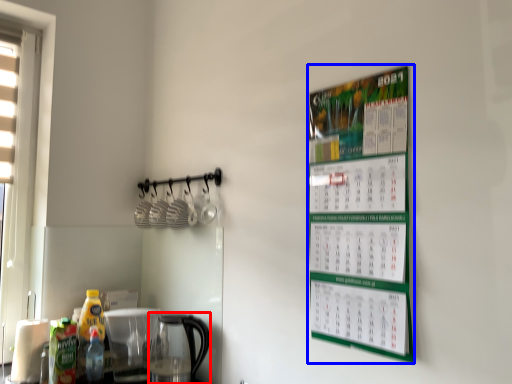
Question: Which of the following is the farthest to the observer, coffeepot (highlighted by a red box) or bulletin board (highlighted by a blue box)?

Choices:
 (A) coffeepot
 (B) bulletin board

Answer: (A)